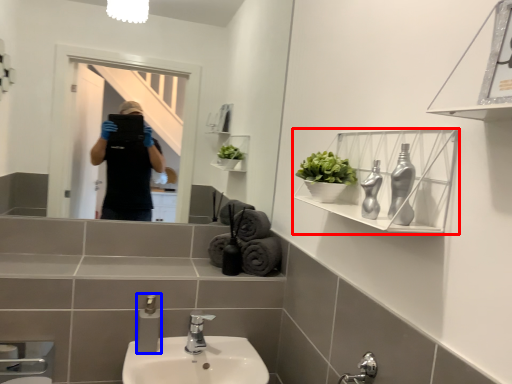
Question: Among these objects, which one is farthest to the camera, shelf (highlighted by a red box) or soap dispenser (highlighted by a blue box)?

Choices:
 (A) shelf
 (B) soap dispenser

Answer: (B)